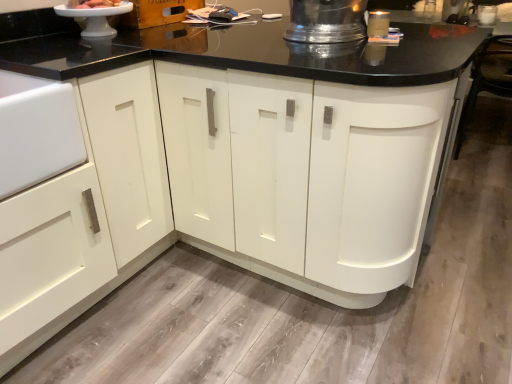
Question: Can you confirm if white glossy cake stand at upper left, placed as the 1th appliance when sorted from left to right, is bigger than shiny metallic pitcher at upper center, the 2th appliance in the left-to-right sequence?

Choices:
 (A) yes
 (B) no

Answer: (B)

Question: Is white glossy cake stand at upper left, placed as the 2th appliance when sorted from right to left, aimed at shiny metallic pitcher at upper center, placed as the 1th appliance when sorted from right to left?

Choices:
 (A) no
 (B) yes

Answer: (B)

Question: From a real-world perspective, does white glossy cake stand at upper left, placed as the 1th appliance when sorted from left to right, stand above shiny metallic pitcher at upper center, the 2th appliance in the left-to-right sequence?

Choices:
 (A) yes
 (B) no

Answer: (B)

Question: Is white glossy cake stand at upper left, placed as the 1th appliance when sorted from left to right, turned away from shiny metallic pitcher at upper center, placed as the 1th appliance when sorted from right to left?

Choices:
 (A) yes
 (B) no

Answer: (B)

Question: Does white glossy cake stand at upper left, placed as the 2th appliance when sorted from right to left, lie in front of shiny metallic pitcher at upper center, placed as the 1th appliance when sorted from right to left?

Choices:
 (A) yes
 (B) no

Answer: (B)

Question: From the image's perspective, is white glossy cake stand at upper left, placed as the 1th appliance when sorted from left to right, over shiny metallic pitcher at upper center, the 2th appliance in the left-to-right sequence?

Choices:
 (A) no
 (B) yes

Answer: (B)

Question: From the image's perspective, is white glossy cake at upper left located beneath white glossy cake stand at upper left, placed as the 1th appliance when sorted from left to right?

Choices:
 (A) no
 (B) yes

Answer: (A)

Question: Does white glossy cake at upper left have a smaller size compared to white glossy cake stand at upper left, placed as the 2th appliance when sorted from right to left?

Choices:
 (A) no
 (B) yes

Answer: (B)

Question: Is white glossy cake at upper left outside white glossy cake stand at upper left, placed as the 1th appliance when sorted from left to right?

Choices:
 (A) yes
 (B) no

Answer: (A)

Question: Is white glossy cake at upper left oriented away from white glossy cake stand at upper left, placed as the 1th appliance when sorted from left to right?

Choices:
 (A) yes
 (B) no

Answer: (B)

Question: Is white glossy cake at upper left positioned far away from white glossy cake stand at upper left, placed as the 1th appliance when sorted from left to right?

Choices:
 (A) yes
 (B) no

Answer: (B)

Question: Is white glossy cake at upper left oriented towards white glossy cake stand at upper left, placed as the 1th appliance when sorted from left to right?

Choices:
 (A) yes
 (B) no

Answer: (B)

Question: Does white glossy cake stand at upper left, placed as the 2th appliance when sorted from right to left, lie in front of white glossy cake at upper left?

Choices:
 (A) yes
 (B) no

Answer: (A)